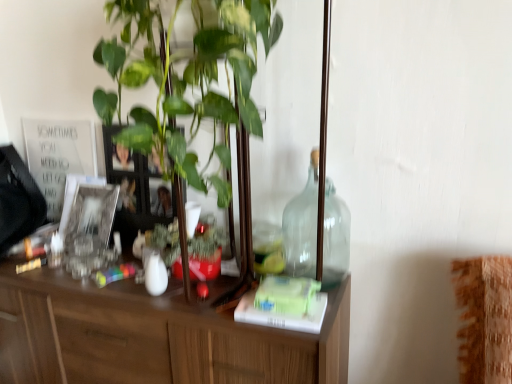
Question: In the image, is silver metallic picture frame at left positioned in front of or behind green matte book at center?

Choices:
 (A) behind
 (B) front

Answer: (A)

Question: Does point (70, 205) appear closer or farther from the camera than point (275, 294)?

Choices:
 (A) farther
 (B) closer

Answer: (A)

Question: Which is farther from the white glossy vase at center?

Choices:
 (A) silver metallic picture frame at left
 (B) green matte book at center
 (C) transparent glass bottle at center-right

Answer: (C)

Question: Which is farther from the white glossy vase at center?

Choices:
 (A) silver metallic picture frame at left
 (B) transparent glass bottle at center-right
 (C) green matte book at center

Answer: (B)